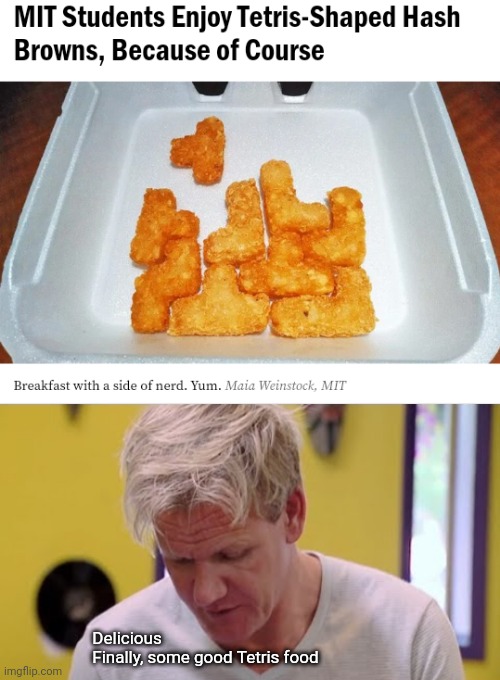
You are a GUI agent. You are given a task and a screenshot of the screen. Output one action in this format:
    pyautogui.click(x=<x>, y=<y>)
    Task: Click on the table
    This screenshot has width=500, height=680.
    Given the screenshot: What is the action you would take?
    pyautogui.click(x=21, y=133)